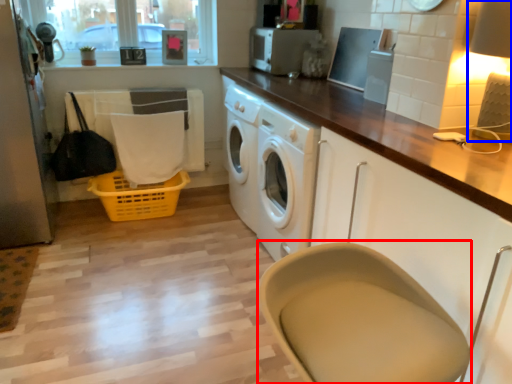
Question: Which point is closer to the camera, feeding chair (highlighted by a red box) or lamp (highlighted by a blue box)?

Choices:
 (A) feeding chair
 (B) lamp

Answer: (A)